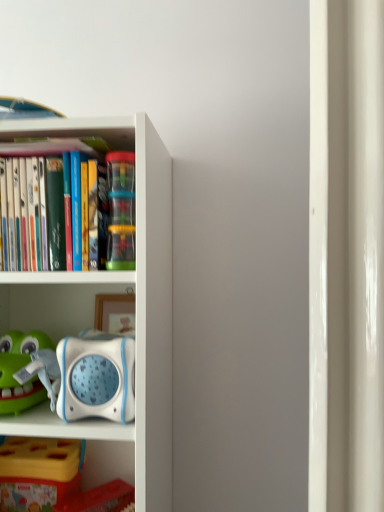
Question: Does point (114, 236) appear closer or farther from the camera than point (39, 501)?

Choices:
 (A) closer
 (B) farther

Answer: (A)

Question: Is translucent plastic cups at center wider or thinner than yellow plastic toy at lower left?

Choices:
 (A) thin
 (B) wide

Answer: (A)

Question: Which is farther from the translucent plastic cups at center?

Choices:
 (A) yellow plastic toy at lower left
 (B) white plastic bookcase at left

Answer: (A)

Question: Which object is the farthest from the yellow plastic toy at lower left?

Choices:
 (A) white plastic bookcase at left
 (B) translucent plastic cups at center

Answer: (B)